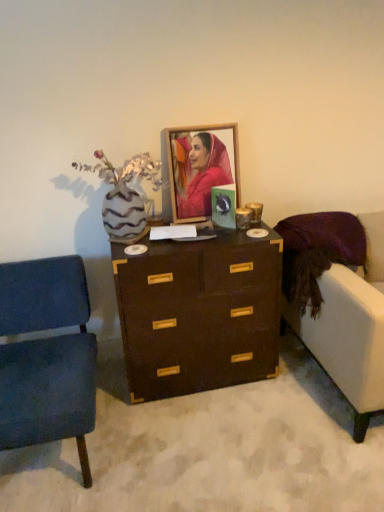
What are the coordinates of `free space in front of brown wood chest of drawers at center` in the screenshot? It's located at (213, 441).